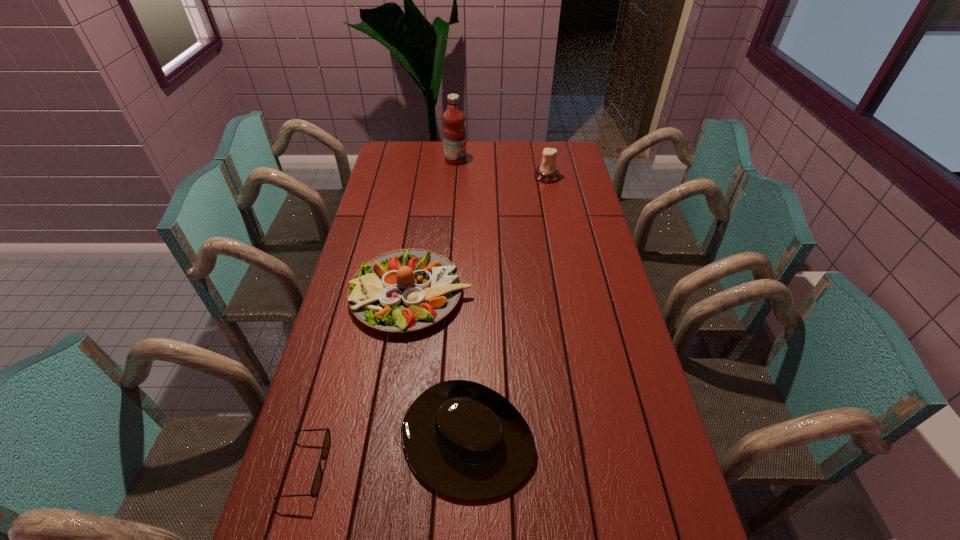
The height and width of the screenshot is (540, 960). I want to click on object that is the second closest to the candle holder, so click(407, 290).

Image resolution: width=960 pixels, height=540 pixels. Identify the location of object identified as the second closest to the fruit juice. (407, 290).

This screenshot has height=540, width=960. What are the coordinates of `free space that satisfies the following two spatial constraints: 1. on the front label of the fruit juice; 2. on the left side of the second tallest object` in the screenshot? It's located at (454, 177).

Find the location of a particular element. This screenshot has width=960, height=540. vacant position in the image that satisfies the following two spatial constraints: 1. on the front label of the tallest object; 2. on the right side of the second farthest object is located at coordinates (454, 177).

This screenshot has width=960, height=540. I want to click on blank space that satisfies the following two spatial constraints: 1. on the back side of the second tallest object; 2. on the front label of the tallest object, so click(x=543, y=160).

You are a GUI agent. You are given a task and a screenshot of the screen. Output one action in this format:
    pyautogui.click(x=<x>, y=<y>)
    Task: Click on the vacant region that satisfies the following two spatial constraints: 1. on the front label of the rightmost object; 2. on the left side of the fruit juice
    This screenshot has width=960, height=540.
    Given the screenshot: What is the action you would take?
    pyautogui.click(x=454, y=177)

Where is `free space that satisfies the following two spatial constraints: 1. on the front label of the cowboy hat; 2. on the left side of the tallest object`? free space that satisfies the following two spatial constraints: 1. on the front label of the cowboy hat; 2. on the left side of the tallest object is located at coordinates (435, 441).

Locate an element on the screen. vacant region that satisfies the following two spatial constraints: 1. on the front label of the fourth nearest object; 2. on the right side of the farthest object is located at coordinates (454, 177).

In order to click on free location that satisfies the following two spatial constraints: 1. on the front label of the fourth nearest object; 2. on the left side of the farthest object in this screenshot , I will do `click(454, 177)`.